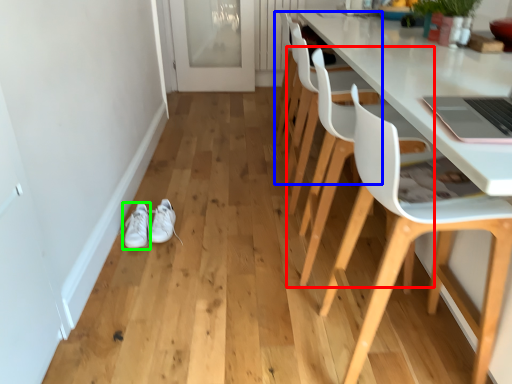
Question: Based on their relative distances, which object is farther from chair (highlighted by a red box)? Choose from chair (highlighted by a blue box) and footwear (highlighted by a green box).

Choices:
 (A) chair
 (B) footwear

Answer: (B)